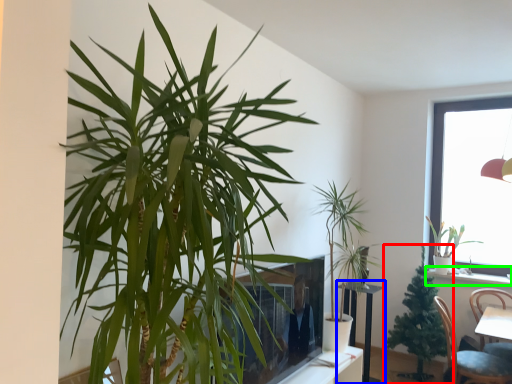
Question: Which is farther away from houseplant (highlighted by a red box)? round table (highlighted by a blue box) or window sill (highlighted by a green box)?

Choices:
 (A) round table
 (B) window sill

Answer: (B)